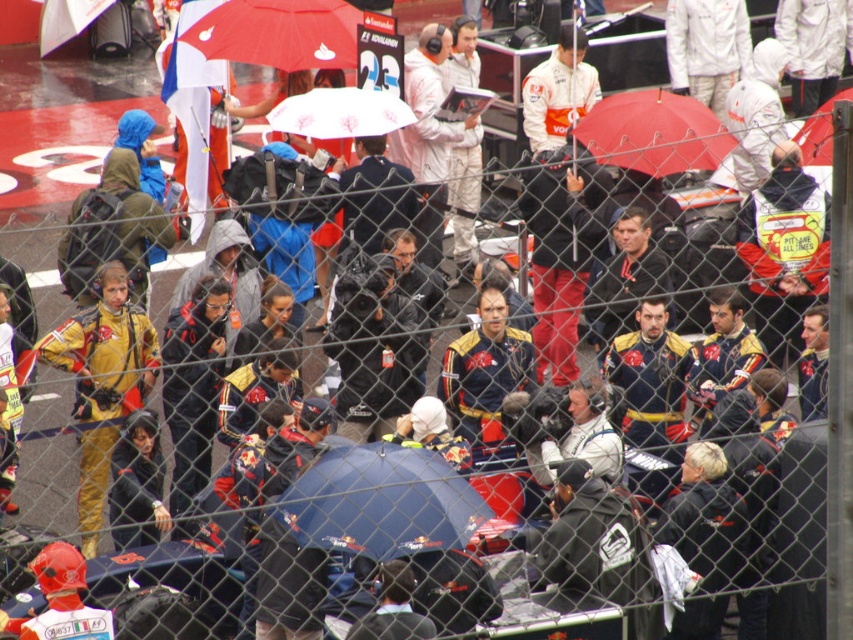
Between red matte umbrella at upper center and white matte umbrella at center, which one has less height?

white matte umbrella at center

Can you confirm if red matte umbrella at upper center is smaller than white matte umbrella at center?

No.

Locate an element on the screen. The height and width of the screenshot is (640, 853). red matte umbrella at upper center is located at coordinates (279, 33).

At what (x,y) coordinates should I click in order to perform the action: click on red matte umbrella at upper center. Please return your answer as a coordinate pair (x, y). This screenshot has height=640, width=853. Looking at the image, I should click on (279, 33).

Is yellow/leather racing suit at left behind white matte umbrella at center?

No, it is in front of white matte umbrella at center.

Between point (103, 264) and point (402, 112), which one is positioned behind?

The point (402, 112) is more distant.

Does point (97, 454) lie in front of point (283, 99)?

Yes, it is.

This screenshot has height=640, width=853. Identify the location of yellow/leather racing suit at left. (105, 349).

Between yellow/leather racing suit at left and matte black umbrella at upper right, which one is positioned lower?

Positioned lower is yellow/leather racing suit at left.

Is point (79, 320) positioned after point (824, 104)?

No, it is in front of (824, 104).

Locate an element on the screen. yellow/leather racing suit at left is located at coordinates (105, 349).